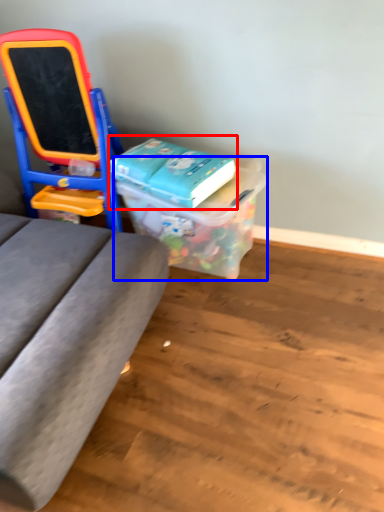
Question: Which of the following is the farthest to the observer, book (highlighted by a red box) or box (highlighted by a blue box)?

Choices:
 (A) book
 (B) box

Answer: (A)